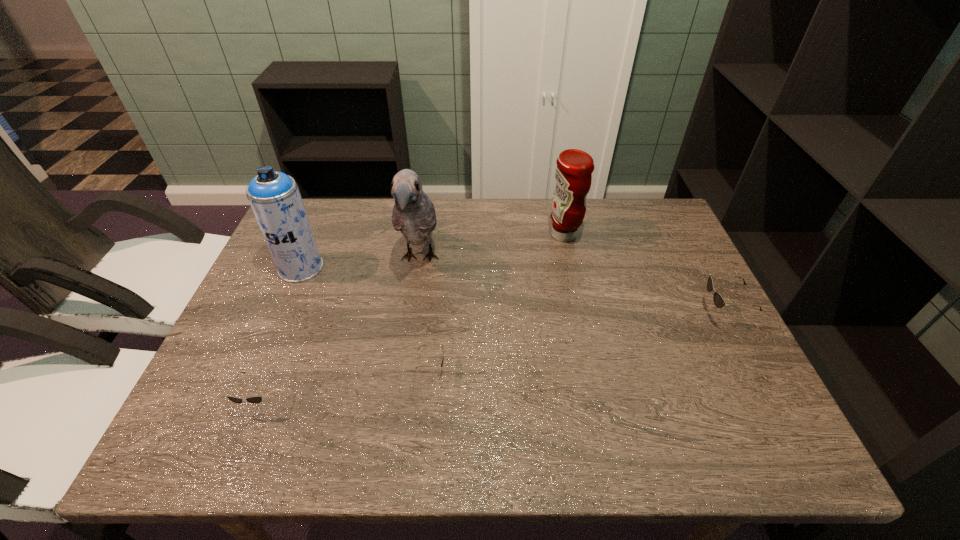
The width and height of the screenshot is (960, 540). Find the location of `the fifth tallest object`. the fifth tallest object is located at coordinates (253, 399).

Find the location of `the second shortest sunglasses`. the second shortest sunglasses is located at coordinates (253, 399).

You are a GUI agent. You are given a task and a screenshot of the screen. Output one action in this format:
    pyautogui.click(x=<x>, y=<y>)
    Task: Click on the second sunglasses from left to right
    The height and width of the screenshot is (540, 960).
    Given the screenshot: What is the action you would take?
    pyautogui.click(x=441, y=364)

Locate an element on the screen. The image size is (960, 540). the shortest sunglasses is located at coordinates (441, 364).

This screenshot has width=960, height=540. Identify the location of the rightmost sunglasses. (719, 301).

Identify the location of the rightmost object. The width and height of the screenshot is (960, 540). (719, 301).

Identify the location of the third tallest object. (573, 176).

You are a GUI agent. You are given a task and a screenshot of the screen. Output one action in this format:
    pyautogui.click(x=<x>, y=<y>)
    Task: Click on the condiment
    Image resolution: width=960 pixels, height=540 pixels.
    Given the screenshot: What is the action you would take?
    pyautogui.click(x=573, y=176)

This screenshot has width=960, height=540. Identify the location of parrot. (414, 215).

Where is `aerosol can`? aerosol can is located at coordinates (275, 199).